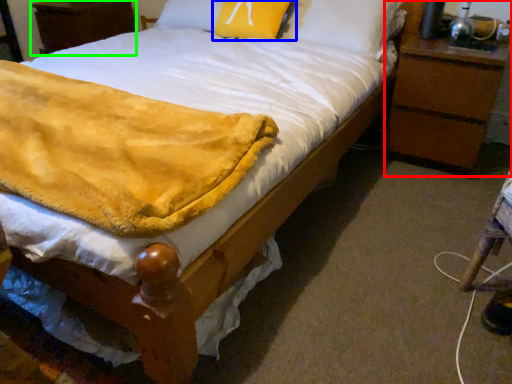
Question: Which object is positioned farthest from nightstand (highlighted by a red box)? Select from pillow (highlighted by a blue box) and nightstand (highlighted by a green box).

Choices:
 (A) pillow
 (B) nightstand

Answer: (B)